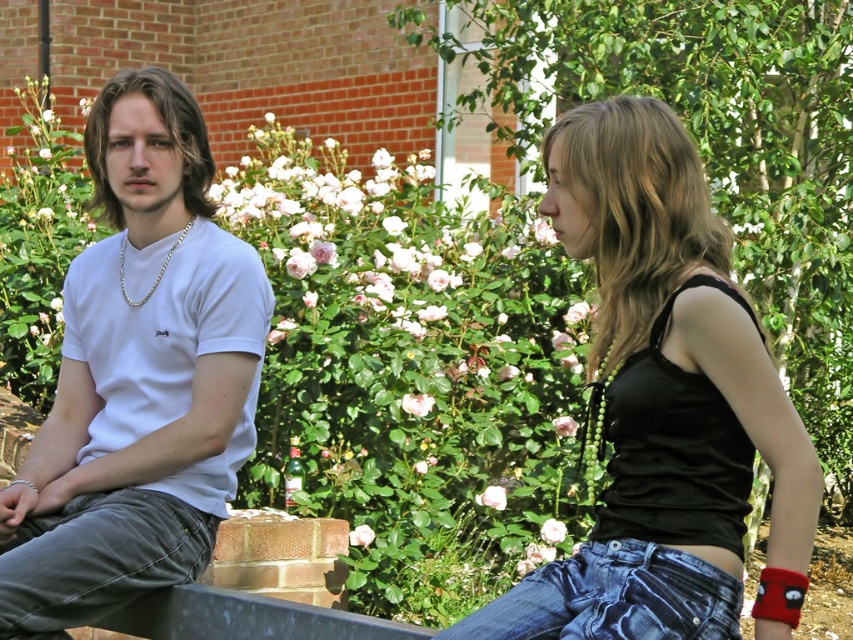
You are a delivery robot with a package that needs to be placed between the black satin tank top at right and the denim at left. The package requires 1 meter of space to be safely placed. Is there enough space between them?

The black satin tank top at right and denim at left are 1.28 meters apart from each other, so yes, there is enough space to place the package between them since 1.28 meters exceeds the required 1 meter.

You are designing a new clothing line and want to create a matching outfit using the black satin tank top at right and the blue denim jeans at lower right. Based on their widths, which garment should you consider adjusting to ensure they align better in terms of proportions?

The black satin tank top at right might be wider than blue denim jeans at lower right, so you should consider adjusting the blue denim jeans at lower right to be wider to match the tank top.